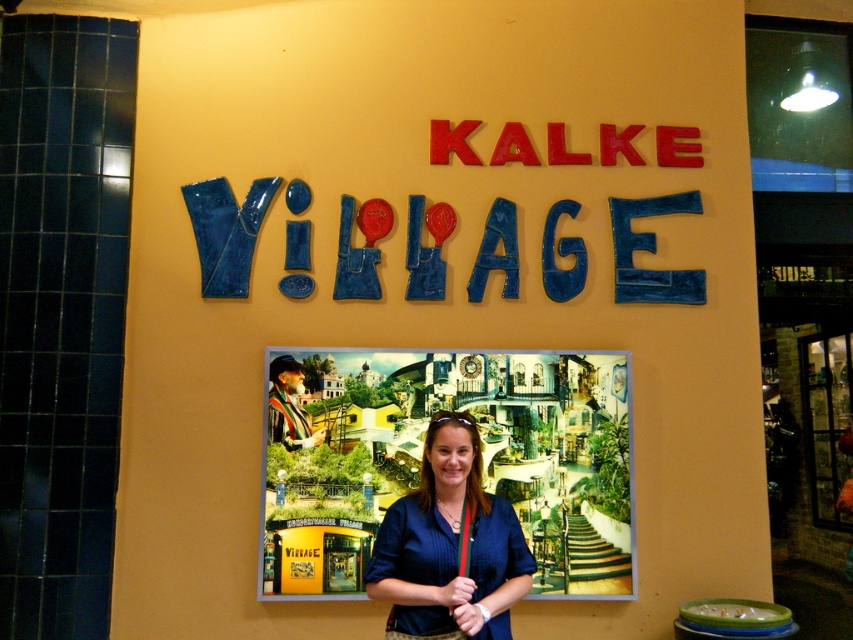
Question: Can you confirm if colorful painted poster at center is positioned to the left of blue fabric shirt at center?

Choices:
 (A) yes
 (B) no

Answer: (A)

Question: Among these objects, which one is farthest from the camera?

Choices:
 (A) blue fabric shirt at center
 (B) colorful painted poster at center

Answer: (B)

Question: Is colorful painted poster at center further to camera compared to blue fabric shirt at center?

Choices:
 (A) no
 (B) yes

Answer: (B)

Question: Is colorful painted poster at center to the left of blue fabric shirt at center from the viewer's perspective?

Choices:
 (A) no
 (B) yes

Answer: (B)

Question: Which point is closer to the camera taking this photo?

Choices:
 (A) (630, 454)
 (B) (430, 609)

Answer: (B)